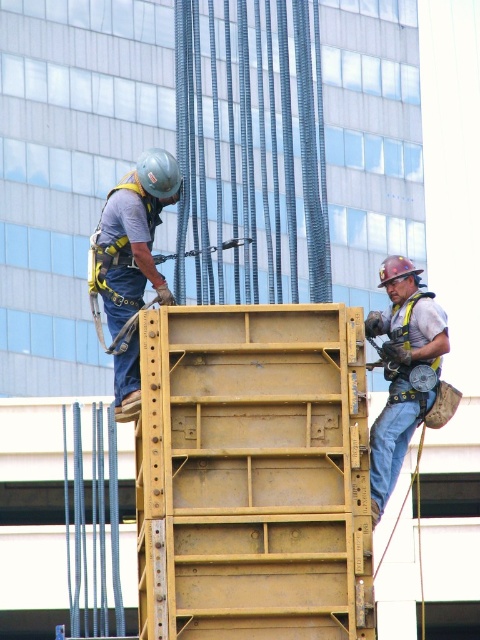
Question: Which of these objects is positioned closest to the yellow metallic frame at center?

Choices:
 (A) matte yellow safety harness at right
 (B) matte gray helmet at upper left

Answer: (A)

Question: Does yellow metallic frame at center have a greater width compared to matte gray helmet at upper left?

Choices:
 (A) yes
 (B) no

Answer: (B)

Question: Does yellow metallic frame at center appear on the right side of matte gray helmet at upper left?

Choices:
 (A) no
 (B) yes

Answer: (B)

Question: Which point is farther from the camera taking this photo?

Choices:
 (A) (298, 563)
 (B) (167, 291)
 (C) (406, 364)

Answer: (C)

Question: Which point is closer to the camera?

Choices:
 (A) yellow metallic frame at center
 (B) matte gray helmet at upper left

Answer: (A)

Question: Is matte gray helmet at upper left thinner than matte yellow safety harness at right?

Choices:
 (A) yes
 (B) no

Answer: (B)